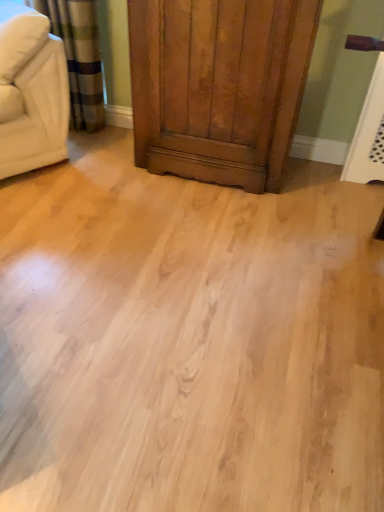
Question: From a real-world perspective, relative to shiny brown wood dresser at center, is beige fabric couch at upper left vertically above or below?

Choices:
 (A) below
 (B) above

Answer: (B)

Question: Looking at their shapes, would you say beige fabric couch at upper left is wider or thinner than shiny brown wood dresser at center?

Choices:
 (A) thin
 (B) wide

Answer: (A)

Question: Which of these objects is positioned closest to the beige fabric couch at upper left?

Choices:
 (A) shiny brown wood dresser at center
 (B) light wood floor at center

Answer: (A)

Question: Which of these objects is positioned farthest from the light wood floor at center?

Choices:
 (A) beige fabric couch at upper left
 (B) shiny brown wood dresser at center

Answer: (A)